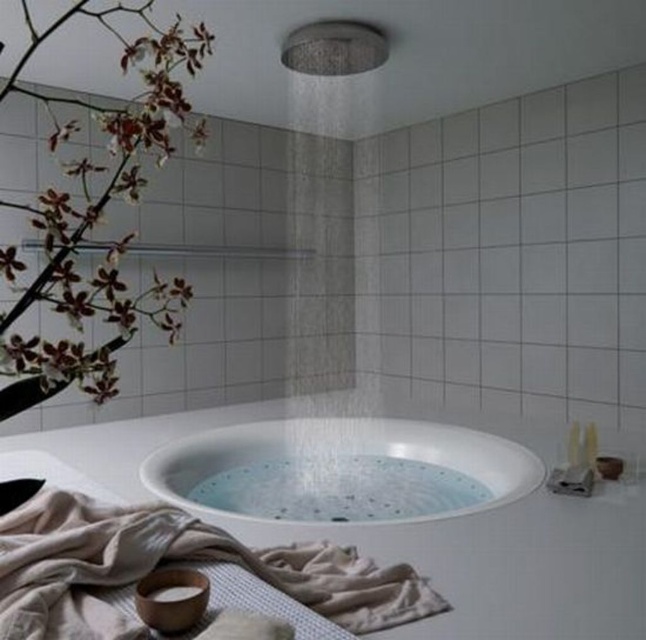
Question: Is white glossy bathtub at center to the right of white matte orchid at upper left from the viewer's perspective?

Choices:
 (A) no
 (B) yes

Answer: (B)

Question: Is white glossy bathtub at center wider than white matte orchid at upper left?

Choices:
 (A) yes
 (B) no

Answer: (A)

Question: Which is nearer to the matte silver shower head at upper center?

Choices:
 (A) white glossy bathtub at center
 (B) white matte orchid at upper left

Answer: (B)

Question: Which is farther from the white matte orchid at upper left?

Choices:
 (A) white glossy bathtub at center
 (B) matte silver shower head at upper center

Answer: (A)

Question: Considering the relative positions of white glossy bathtub at center and matte silver shower head at upper center in the image provided, where is white glossy bathtub at center located with respect to matte silver shower head at upper center?

Choices:
 (A) below
 (B) above

Answer: (A)

Question: Which point is farther from the camera taking this photo?

Choices:
 (A) (444, 496)
 (B) (8, 390)

Answer: (A)